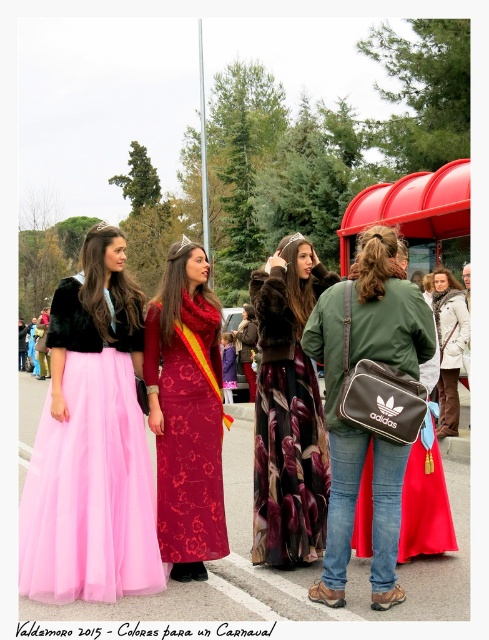
Question: Observing the image, what is the correct spatial positioning of floral-patterned fur coat at center in reference to white textured coat at center?

Choices:
 (A) below
 (B) above

Answer: (A)

Question: Which object appears closest to the camera in this image?

Choices:
 (A) floral-patterned fur coat at center
 (B) pink tulle skirt at left

Answer: (B)

Question: Among these objects, which one is nearest to the camera?

Choices:
 (A) white textured coat at center
 (B) red plastic bus stop at center right
 (C) floral-patterned fur coat at center

Answer: (B)

Question: Can you confirm if pink tulle skirt at left is positioned below floral-patterned fur coat at center?

Choices:
 (A) yes
 (B) no

Answer: (A)

Question: Estimate the real-world distances between objects in this image. Which object is closer to the red plastic bus stop at center right?

Choices:
 (A) pink tulle skirt at left
 (B) floral-patterned fur coat at center
 (C) velvet maroon dress at center
 (D) white textured coat at center

Answer: (D)

Question: Can you confirm if velvet maroon dress at center is smaller than red plastic bus stop at center right?

Choices:
 (A) yes
 (B) no

Answer: (A)